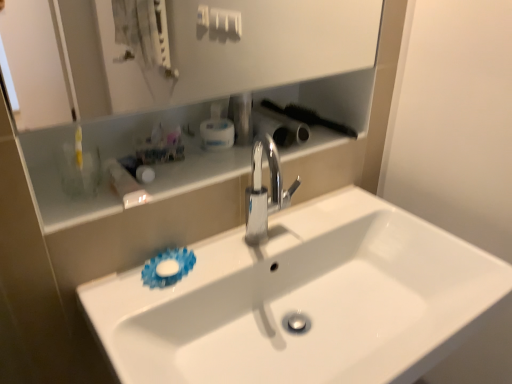
Question: Is white glossy shelf at upper center thinner than black plastic brush at upper right, the second brush positioned from the left?

Choices:
 (A) no
 (B) yes

Answer: (B)

Question: Would you say white glossy shelf at upper center is outside black plastic brush at upper right, the second brush positioned from the left?

Choices:
 (A) yes
 (B) no

Answer: (A)

Question: Is white glossy shelf at upper center shorter than black plastic brush at upper right, the second brush positioned from the left?

Choices:
 (A) yes
 (B) no

Answer: (A)

Question: Is white glossy shelf at upper center closer to the viewer compared to black plastic brush at upper right, which is the 1th brush in right-to-left order?

Choices:
 (A) yes
 (B) no

Answer: (A)

Question: From a real-world perspective, is white glossy shelf at upper center below black plastic brush at upper right, which is the 1th brush in right-to-left order?

Choices:
 (A) yes
 (B) no

Answer: (A)

Question: Is white glossy shelf at upper center beside black plastic brush at upper right, which is the 1th brush in right-to-left order?

Choices:
 (A) yes
 (B) no

Answer: (B)

Question: Can you confirm if white plastic mouthwash at upper center is smaller than black plastic brush at upper right, the second brush positioned from the left?

Choices:
 (A) no
 (B) yes

Answer: (B)

Question: Is white plastic mouthwash at upper center completely or partially outside of black plastic brush at upper right, the second brush positioned from the left?

Choices:
 (A) no
 (B) yes

Answer: (B)

Question: Considering the relative positions of white plastic mouthwash at upper center and black plastic brush at upper right, which is the 1th brush in right-to-left order, in the image provided, is white plastic mouthwash at upper center to the right of black plastic brush at upper right, which is the 1th brush in right-to-left order, from the viewer's perspective?

Choices:
 (A) yes
 (B) no

Answer: (B)

Question: Does white plastic mouthwash at upper center come in front of black plastic brush at upper right, the second brush positioned from the left?

Choices:
 (A) yes
 (B) no

Answer: (A)

Question: Is white plastic mouthwash at upper center bigger than black plastic brush at upper right, the second brush positioned from the left?

Choices:
 (A) no
 (B) yes

Answer: (A)

Question: Could you tell me if white plastic mouthwash at upper center is turned towards black plastic brush at upper right, which is the 1th brush in right-to-left order?

Choices:
 (A) yes
 (B) no

Answer: (B)

Question: Is white glossy shelf at upper center smaller than white glossy sink at center?

Choices:
 (A) no
 (B) yes

Answer: (B)